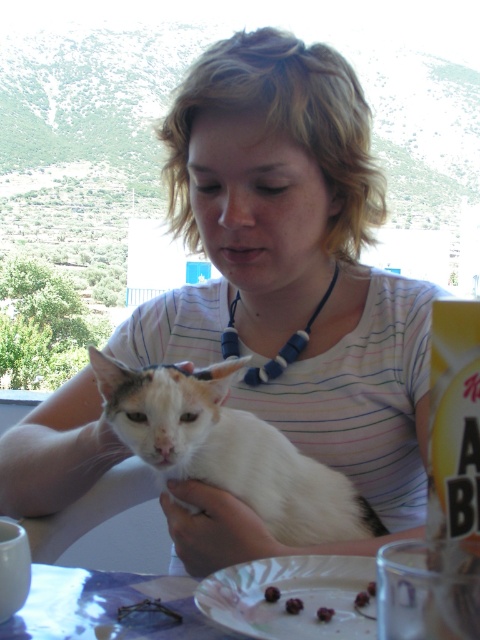
Which is below, white fur cat at center or smooth brown cookie at lower center?

Positioned lower is smooth brown cookie at lower center.

Which is more to the left, white fur cat at center or smooth brown cookie at lower center?

white fur cat at center

Is point (339, 518) positioned in front of point (363, 602)?

That is False.

Locate an element on the screen. The image size is (480, 640). white fur cat at center is located at coordinates (228, 449).

Is white paper plate at lower center below smooth brown cherry at center?

No, white paper plate at lower center is not below smooth brown cherry at center.

Does point (206, 604) lie in front of point (324, 618)?

No, it is not.

Between point (310, 634) and point (327, 609), which one is positioned behind?

Positioned behind is point (327, 609).

What are the coordinates of `white paper plate at lower center` in the screenshot? It's located at (292, 596).

Is white fur cat at center positioned behind shiny dark chocolate cherry at plate center?

That is True.

Does white fur cat at center have a larger size compared to shiny dark chocolate cherry at plate center?

Yes.

Locate an element on the screen. white fur cat at center is located at coordinates (228, 449).